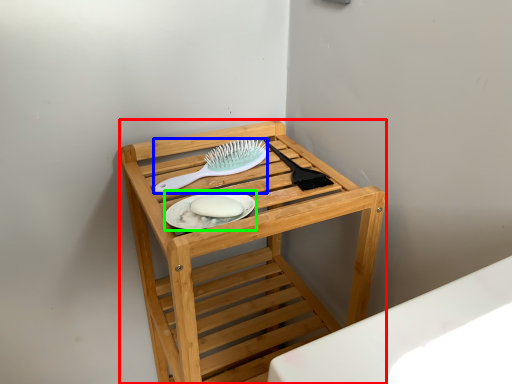
Question: Which object is the closest to the furniture (highlighted by a red box)? Choose among these: brush (highlighted by a blue box) or platter (highlighted by a green box).

Choices:
 (A) brush
 (B) platter

Answer: (A)